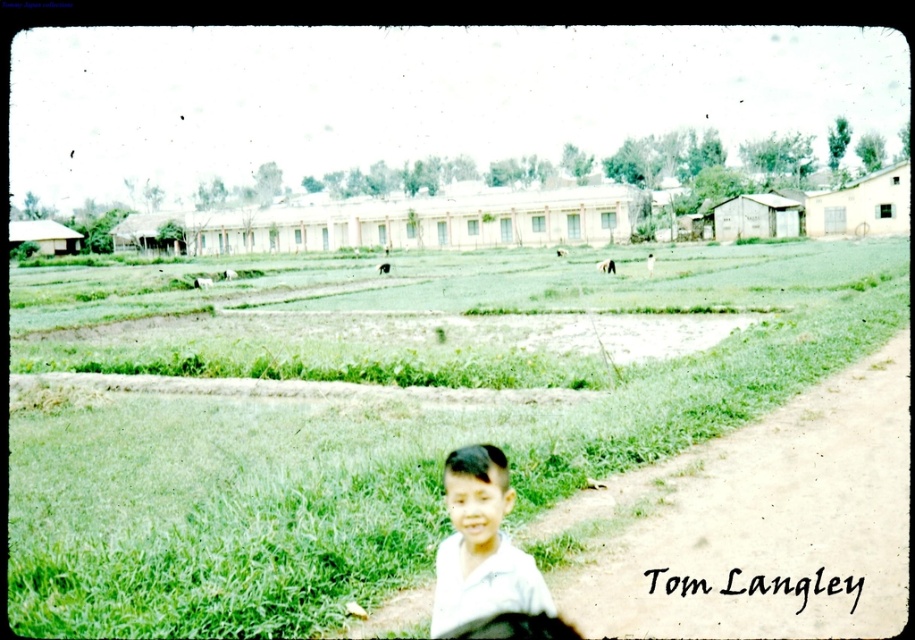
You are standing at the point labeled as point (380, 417) in the image. What do you see directly in front of you?

You see green grass at center directly in front of you at point (380, 417).